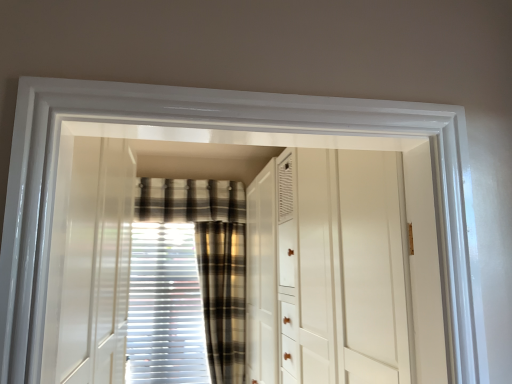
Question: From the image's perspective, is plaid fabric curtain at center, the first curtain from the right, over plaid fabric at center?

Choices:
 (A) no
 (B) yes

Answer: (A)

Question: Does plaid fabric curtain at center, the first curtain from the right, have a larger size compared to plaid fabric at center?

Choices:
 (A) no
 (B) yes

Answer: (B)

Question: Does plaid fabric curtain at center, the first curtain from the right, appear on the left side of plaid fabric at center?

Choices:
 (A) yes
 (B) no

Answer: (B)

Question: Is plaid fabric at center a part of plaid fabric curtain at center, the first curtain from the right?

Choices:
 (A) no
 (B) yes

Answer: (A)

Question: Is plaid fabric curtain at center, which is the 2th curtain in left-to-right order, facing away from plaid fabric at center?

Choices:
 (A) yes
 (B) no

Answer: (B)

Question: Is plaid fabric curtain at center, which is the 2th curtain in left-to-right order, in front of or behind white glossy dresser at center in the image?

Choices:
 (A) behind
 (B) front

Answer: (A)

Question: Looking at the image, does plaid fabric curtain at center, the first curtain from the right, seem bigger or smaller compared to white glossy dresser at center?

Choices:
 (A) big
 (B) small

Answer: (B)

Question: In terms of height, does plaid fabric curtain at center, which is the 2th curtain in left-to-right order, look taller or shorter compared to white glossy dresser at center?

Choices:
 (A) tall
 (B) short

Answer: (B)

Question: From a real-world perspective, is plaid fabric curtain at center, the first curtain from the right, physically located above or below white glossy dresser at center?

Choices:
 (A) above
 (B) below

Answer: (B)

Question: Visually, is plaid fabric at center positioned to the left or to the right of white glossy dresser at center?

Choices:
 (A) left
 (B) right

Answer: (A)

Question: Considering their positions, is plaid fabric at center located in front of or behind white glossy dresser at center?

Choices:
 (A) behind
 (B) front

Answer: (A)

Question: Would you say plaid fabric at center is inside or outside white glossy dresser at center?

Choices:
 (A) outside
 (B) inside

Answer: (A)

Question: In terms of height, does plaid fabric at center look taller or shorter compared to white glossy dresser at center?

Choices:
 (A) tall
 (B) short

Answer: (B)

Question: In the image, is white textured blinds at center, the 2th curtain when ordered from right to left, on the left side or the right side of plaid fabric curtain at center, the first curtain from the right?

Choices:
 (A) right
 (B) left

Answer: (B)

Question: From the image's perspective, relative to plaid fabric curtain at center, which is the 2th curtain in left-to-right order, is white textured blinds at center, acting as the 1th curtain starting from the left, above or below?

Choices:
 (A) below
 (B) above

Answer: (A)